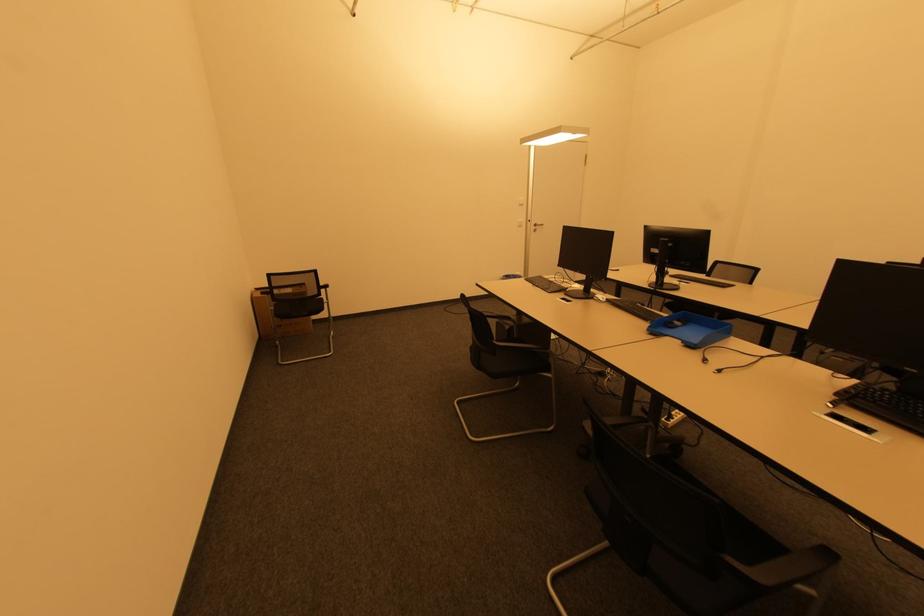
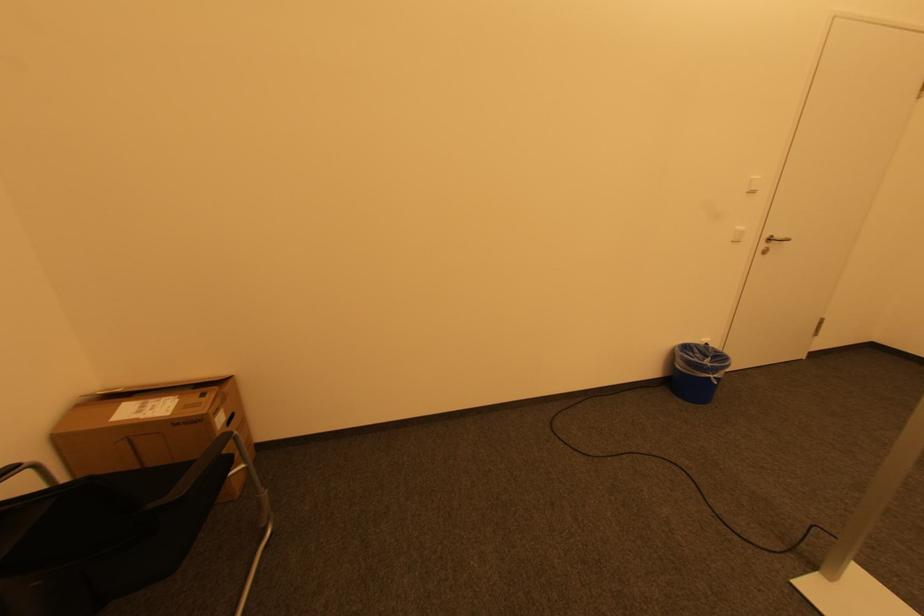
Question: What movement of the cameraman would produce the second image?

Choices:
 (A) Left
 (B) Right
 (C) Forward
 (D) Backward

Answer: (C)